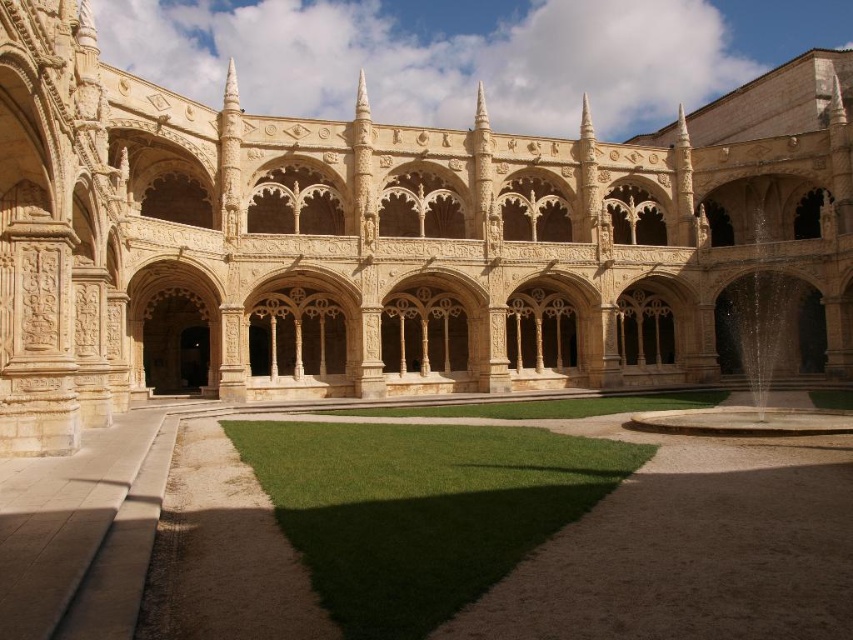
Between beige stone arches at center and green grass at center, which one appears on the left side from the viewer's perspective?

green grass at center

Is point (282, 168) positioned in front of point (850, 445)?

No, (282, 168) is further to viewer.

Between point (672, 170) and point (94, 536), which one is positioned in front?

Point (94, 536)

The width and height of the screenshot is (853, 640). I want to click on beige stone arches at center, so click(381, 240).